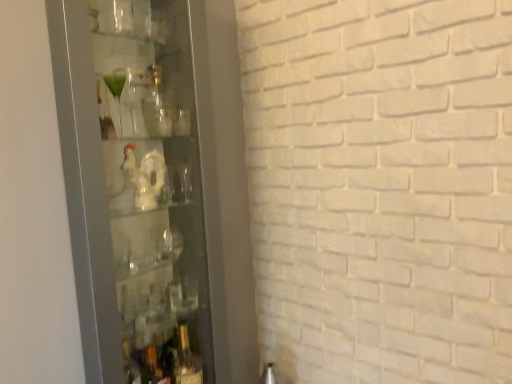
Measure the distance between transparent glass cabinet at left and camera.

transparent glass cabinet at left and camera are 96.32 centimeters apart from each other.

This screenshot has width=512, height=384. What are the coordinates of `transparent glass cabinet at left` in the screenshot? It's located at [133, 184].

What do you see at coordinates (133, 184) in the screenshot? This screenshot has width=512, height=384. I see `transparent glass cabinet at left` at bounding box center [133, 184].

What is the approximate height of translucent glass bottle at lower center?

9.36 inches.

Describe the element at coordinates (187, 361) in the screenshot. I see `translucent glass bottle at lower center` at that location.

This screenshot has width=512, height=384. Identify the location of translucent glass bottle at lower center. (187, 361).

At what (x,y) coordinates should I click in order to perform the action: click on transparent glass cabinet at left. Please return your answer as a coordinate pair (x, y). The height and width of the screenshot is (384, 512). Looking at the image, I should click on (133, 184).

Based on their positions, is translucent glass bottle at lower center located to the left or right of transparent glass cabinet at left?

Based on their positions, translucent glass bottle at lower center is located to the right of transparent glass cabinet at left.

Is translucent glass bottle at lower center in front of or behind transparent glass cabinet at left in the image?

translucent glass bottle at lower center is positioned farther from the viewer than transparent glass cabinet at left.

Is point (184, 364) more distant than point (130, 208)?

That is True.

From the image's perspective, is translucent glass bottle at lower center above or below transparent glass cabinet at left?

Clearly, from the image's perspective, translucent glass bottle at lower center is below transparent glass cabinet at left.

From a real-world perspective, who is located higher, translucent glass bottle at lower center or transparent glass cabinet at left?

From a 3D spatial view, transparent glass cabinet at left is above.

Considering the sizes of translucent glass bottle at lower center and transparent glass cabinet at left in the image, is translucent glass bottle at lower center wider or thinner than transparent glass cabinet at left?

In the image, translucent glass bottle at lower center appears to be more narrow than transparent glass cabinet at left.

From their relative heights in the image, would you say translucent glass bottle at lower center is taller or shorter than transparent glass cabinet at left?

Considering their sizes, translucent glass bottle at lower center has less height than transparent glass cabinet at left.

Considering the sizes of translucent glass bottle at lower center and transparent glass cabinet at left in the image, is translucent glass bottle at lower center bigger or smaller than transparent glass cabinet at left?

In the image, translucent glass bottle at lower center appears to be smaller than transparent glass cabinet at left.

Which is correct: translucent glass bottle at lower center is inside transparent glass cabinet at left, or outside of it?

translucent glass bottle at lower center is located inside transparent glass cabinet at left.

Is translucent glass bottle at lower center far from transparent glass cabinet at left?

No.

Consider the image. Is translucent glass bottle at lower center looking in the opposite direction of transparent glass cabinet at left?

Absolutely, translucent glass bottle at lower center is directed away from transparent glass cabinet at left.

Looking at this image, can you tell me how much translucent glass bottle at lower center and transparent glass cabinet at left differ in facing direction?

0.000867 degrees separate the facing orientations of translucent glass bottle at lower center and transparent glass cabinet at left.

This screenshot has height=384, width=512. I want to click on bottle below the transparent glass cabinet at left (from the image's perspective), so click(x=187, y=361).

Considering the positions of objects transparent glass cabinet at left and translucent glass bottle at lower center in the image provided, who is more to the left, transparent glass cabinet at left or translucent glass bottle at lower center?

transparent glass cabinet at left.

Considering the relative positions of transparent glass cabinet at left and translucent glass bottle at lower center in the image provided, is transparent glass cabinet at left behind translucent glass bottle at lower center?

No, transparent glass cabinet at left is closer to the viewer.

Considering the points (134, 225) and (193, 354), which point is behind, point (134, 225) or point (193, 354)?

The point (193, 354) is farther from the camera.

From the image's perspective, is transparent glass cabinet at left over translucent glass bottle at lower center?

Yes, from the image's perspective, transparent glass cabinet at left is over translucent glass bottle at lower center.

From a real-world perspective, between transparent glass cabinet at left and translucent glass bottle at lower center, who is vertically higher?

From a 3D spatial view, transparent glass cabinet at left is above.

Which object is thinner, transparent glass cabinet at left or translucent glass bottle at lower center?

Thinner between the two is translucent glass bottle at lower center.

Between transparent glass cabinet at left and translucent glass bottle at lower center, which one has more height?

With more height is transparent glass cabinet at left.

Considering the sizes of transparent glass cabinet at left and translucent glass bottle at lower center in the image, is transparent glass cabinet at left bigger or smaller than translucent glass bottle at lower center?

Considering their sizes, transparent glass cabinet at left takes up more space than translucent glass bottle at lower center.

Can translucent glass bottle at lower center be found inside transparent glass cabinet at left?

Yes, translucent glass bottle at lower center can be found within transparent glass cabinet at left.

Is transparent glass cabinet at left not close to translucent glass bottle at lower center?

No, transparent glass cabinet at left is not far from translucent glass bottle at lower center.

Is translucent glass bottle at lower center at the back of transparent glass cabinet at left?

Yes, translucent glass bottle at lower center is at the back of transparent glass cabinet at left.

How different are the orientations of transparent glass cabinet at left and translucent glass bottle at lower center in degrees?

The angular difference between transparent glass cabinet at left and translucent glass bottle at lower center is 0.000867 degrees.

The height and width of the screenshot is (384, 512). I want to click on glass door on the left side of translucent glass bottle at lower center, so click(133, 184).

Where is `bottle to the right of transparent glass cabinet at left`? bottle to the right of transparent glass cabinet at left is located at coordinates (187, 361).

Image resolution: width=512 pixels, height=384 pixels. Identify the location of glass door above the translucent glass bottle at lower center (from a real-world perspective). (133, 184).